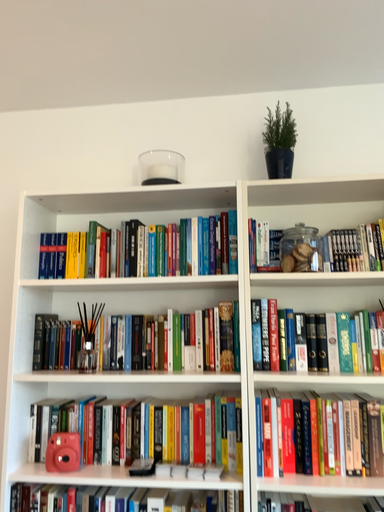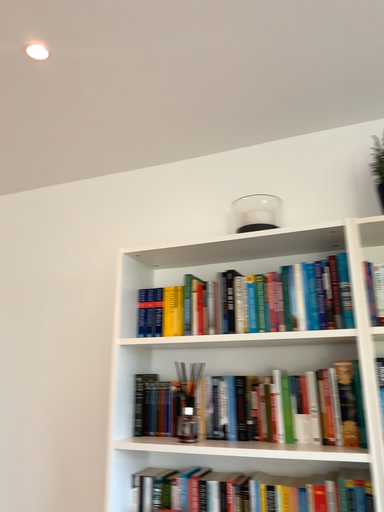
Question: Which way did the camera rotate in the video?

Choices:
 (A) rotated upward
 (B) rotated downward

Answer: (A)